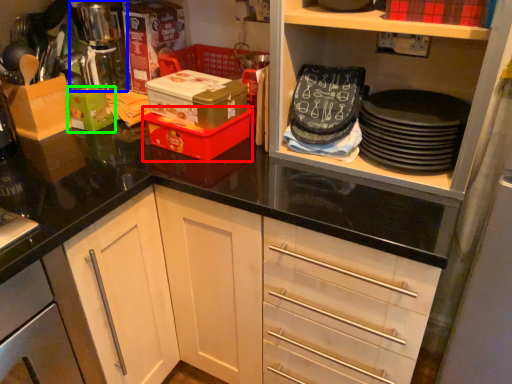
Question: Which is nearer to the box (highlighted by a red box)? coffee machine (highlighted by a blue box) or box (highlighted by a green box).

Choices:
 (A) coffee machine
 (B) box

Answer: (B)